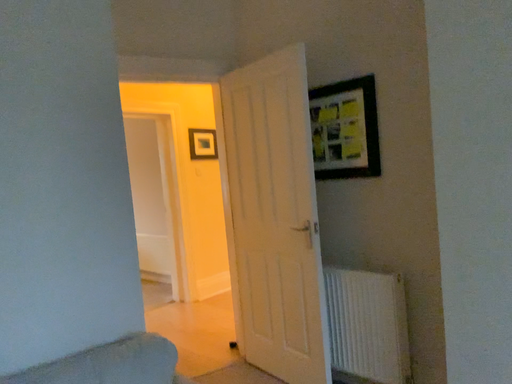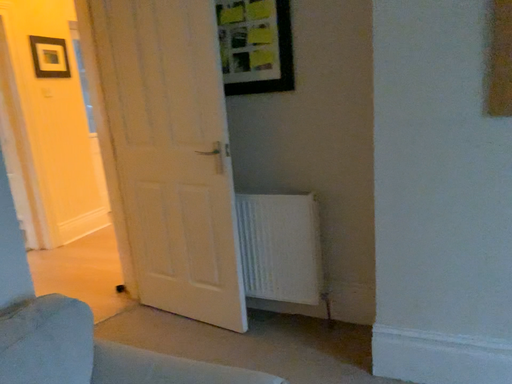
Question: Which way did the camera rotate in the video?

Choices:
 (A) rotated upward
 (B) rotated downward

Answer: (B)